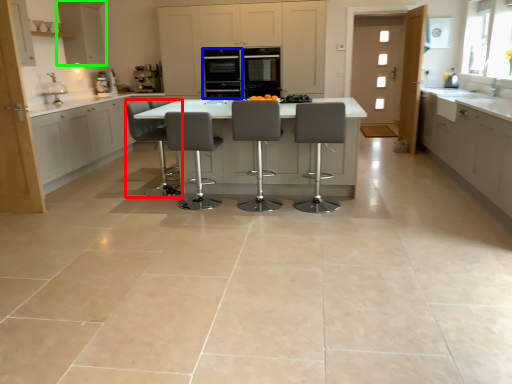
Question: Estimate the real-world distances between objects in this image. Which object is farther from chair (highlighted by a red box), appliance (highlighted by a blue box) or cabinetry (highlighted by a green box)?

Choices:
 (A) appliance
 (B) cabinetry

Answer: (B)